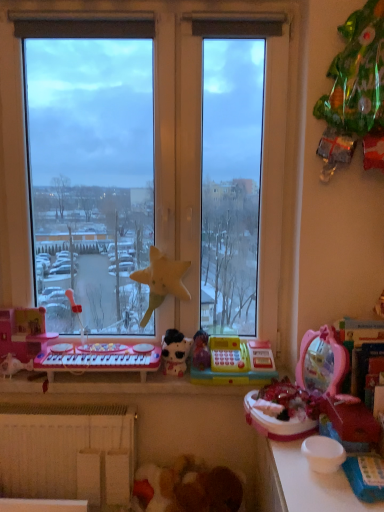
Identify the location of free space underneath pink plastic musical keyboard at lower left (from a real-world perspective). Image resolution: width=384 pixels, height=512 pixels. (103, 381).